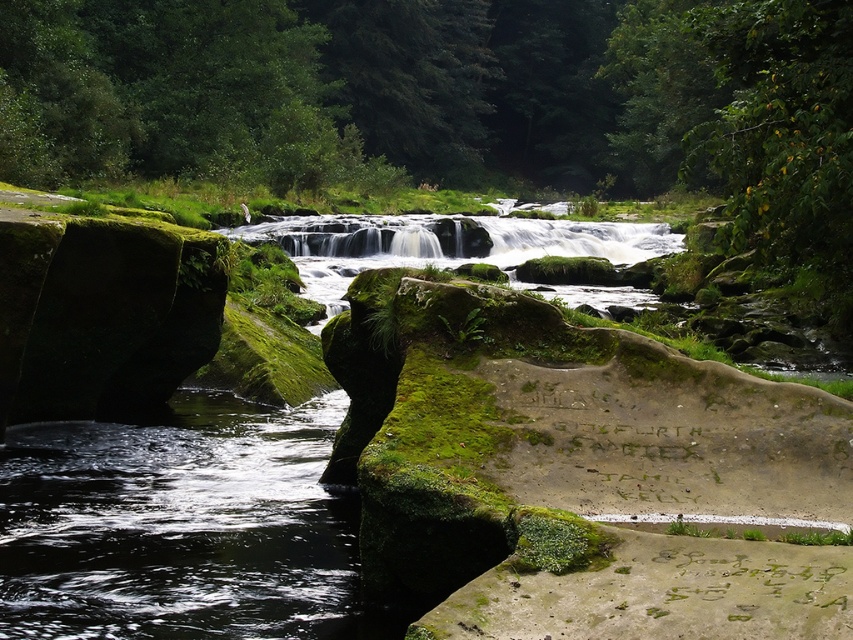
Which is more to the left, clear water at center or white smooth water at center?

From the viewer's perspective, clear water at center appears more on the left side.

Which is behind, point (279, 426) or point (328, 236)?

The point (328, 236) is more distant.

Is point (137, 424) behind point (392, 234)?

No, (137, 424) is closer to viewer.

Image resolution: width=853 pixels, height=640 pixels. Find the location of `clear water at center`. clear water at center is located at coordinates (178, 525).